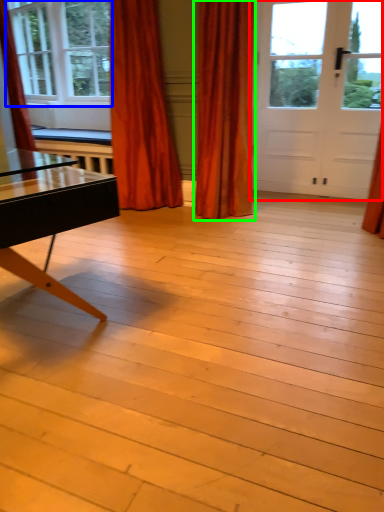
Question: Considering the real-world distances, which object is farthest from door (highlighted by a red box)? window (highlighted by a blue box) or curtain (highlighted by a green box)?

Choices:
 (A) window
 (B) curtain

Answer: (A)